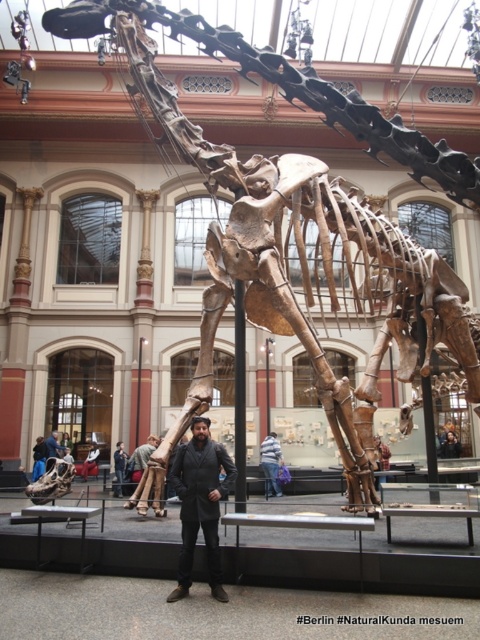
Question: Is bone-like skeleton at center smaller than striped shirt at center?

Choices:
 (A) yes
 (B) no

Answer: (B)

Question: Among these objects, which one is nearest to the camera?

Choices:
 (A) bone-like skeleton at center
 (B) striped shirt at center
 (C) dark gray coat at center

Answer: (C)

Question: Which object is positioned closest to the dark gray coat at center?

Choices:
 (A) dark brown leather jacket at center
 (B) striped shirt at center
 (C) bone-like skeleton at center

Answer: (C)

Question: Does dark gray coat at center have a smaller size compared to striped shirt at center?

Choices:
 (A) yes
 (B) no

Answer: (A)

Question: Can you confirm if dark gray coat at center is bigger than striped shirt at center?

Choices:
 (A) no
 (B) yes

Answer: (A)

Question: Among these objects, which one is farthest from the camera?

Choices:
 (A) dark gray coat at center
 (B) dark brown leather jacket at center
 (C) striped shirt at center

Answer: (B)